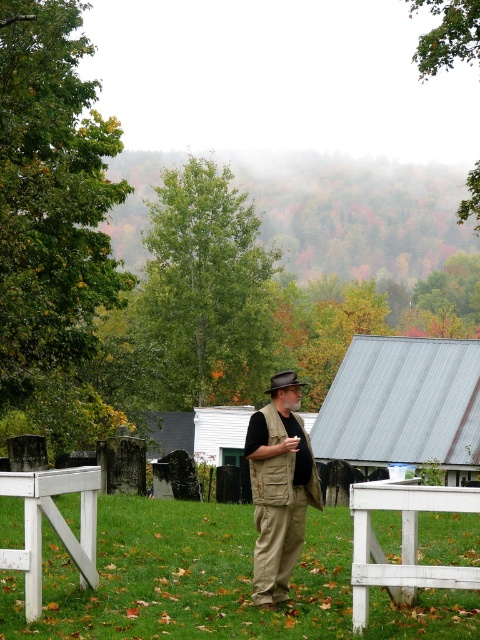
Is metallic gray hut at center-right positioned in front of white painted wood picnic table at lower left?

No, it is not.

Who is positioned more to the left, metallic gray hut at center-right or white painted wood picnic table at lower left?

white painted wood picnic table at lower left

Is point (443, 460) in front of point (48, 480)?

No, it is not.

Locate an element on the screen. metallic gray hut at center-right is located at coordinates (404, 404).

Can you confirm if white wooden picnic table at lower right is smaller than brown felt cowboy hat at center?

Correct, white wooden picnic table at lower right occupies less space than brown felt cowboy hat at center.

Which is more to the left, white wooden picnic table at lower right or brown felt cowboy hat at center?

From the viewer's perspective, brown felt cowboy hat at center appears more on the left side.

Does point (357, 595) come closer to viewer compared to point (280, 381)?

Yes, point (357, 595) is closer to viewer.

The width and height of the screenshot is (480, 640). Identify the location of white wooden picnic table at lower right. (403, 541).

Is point (296, 381) closer to viewer compared to point (287, 381)?

Yes, it is in front of point (287, 381).

Which of these two, khaki cotton pants at center or brown felt cowboy hat at center, stands shorter?

Standing shorter between the two is khaki cotton pants at center.

Where is `khaki cotton pants at center`? The height and width of the screenshot is (640, 480). khaki cotton pants at center is located at coordinates [278, 486].